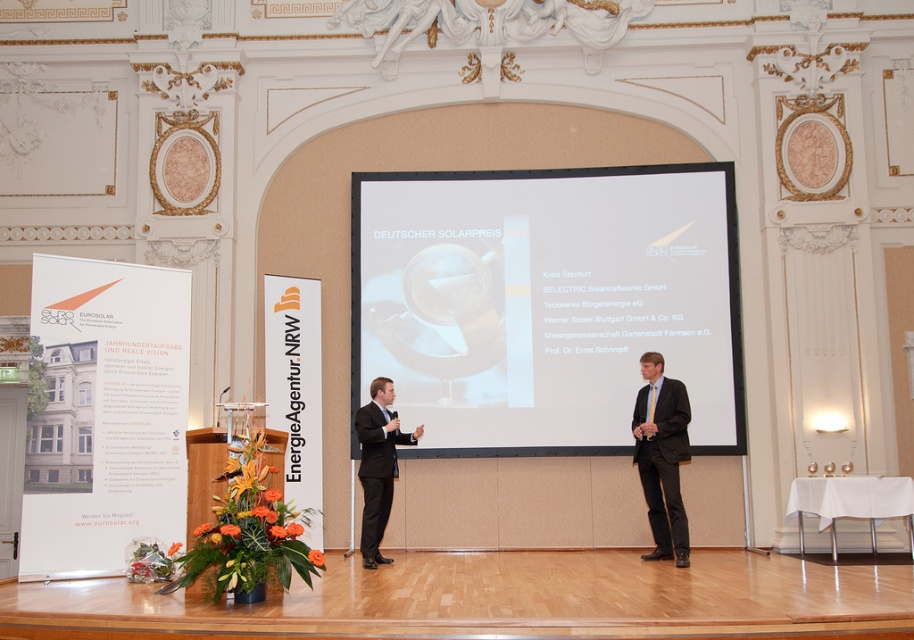
Is dark suit at center above matte black suit at center?

Indeed, dark suit at center is positioned over matte black suit at center.

Measure the distance between point (673, 394) and camera.

Point (673, 394) and camera are 8.93 meters apart from each other.

Is point (668, 436) more distant than point (363, 516)?

No, it is in front of (363, 516).

Locate an element on the screen. dark suit at center is located at coordinates (662, 456).

Can you confirm if white glossy projection screen at center is positioned below matte black suit at center?

No.

Between white glossy projection screen at center and matte black suit at center, which one is positioned higher?

white glossy projection screen at center is higher up.

Which is in front, point (434, 321) or point (377, 413)?

Point (377, 413) is more forward.

Identify the location of white glossy projection screen at center. Image resolution: width=914 pixels, height=640 pixels. (546, 301).

Which is behind, point (457, 419) or point (684, 412)?

The point (457, 419) is more distant.

Is point (392, 323) behind point (661, 532)?

That is True.

Where is `white glossy projection screen at center`? The height and width of the screenshot is (640, 914). white glossy projection screen at center is located at coordinates (546, 301).